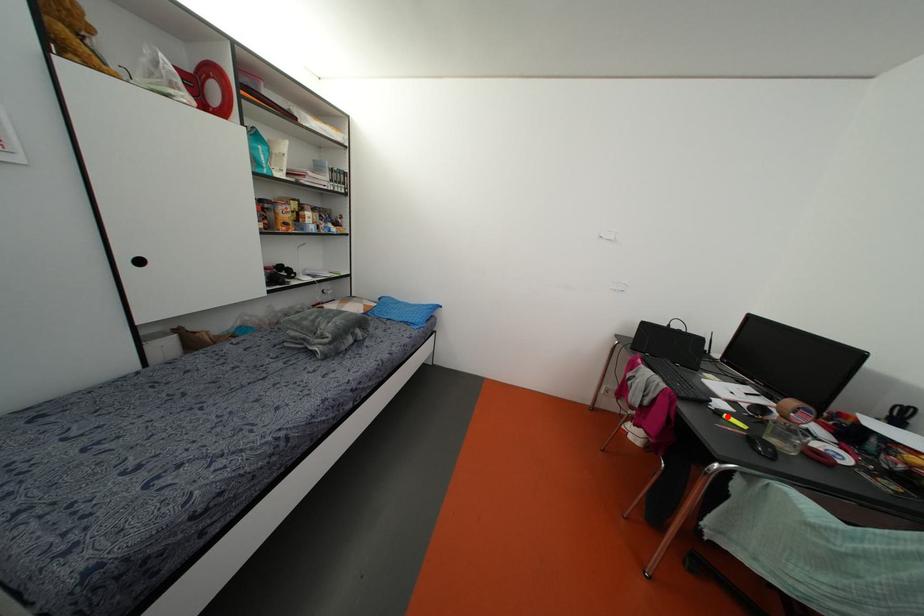
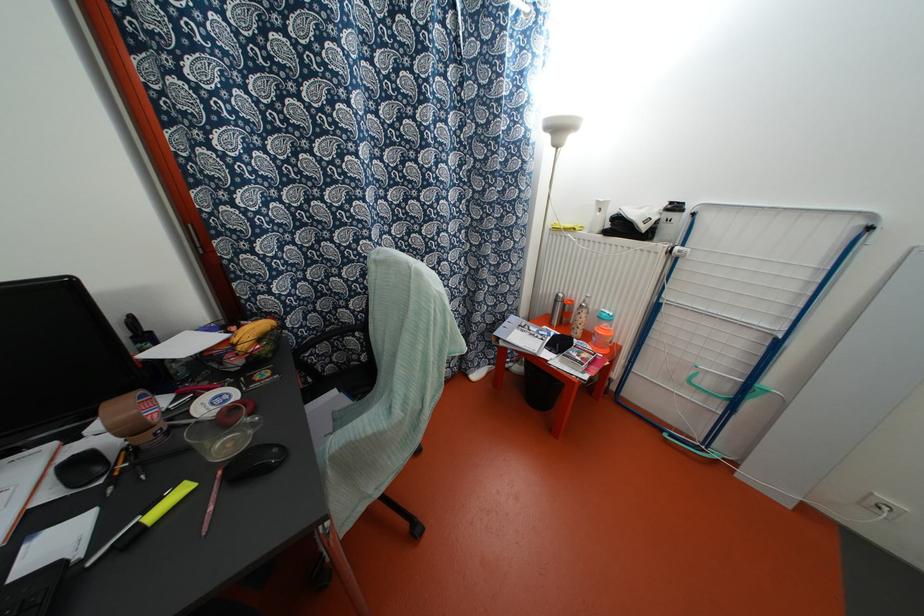
Locate, in the second image, the point that corresponds to the highlighted location in the first image.

(152, 515)